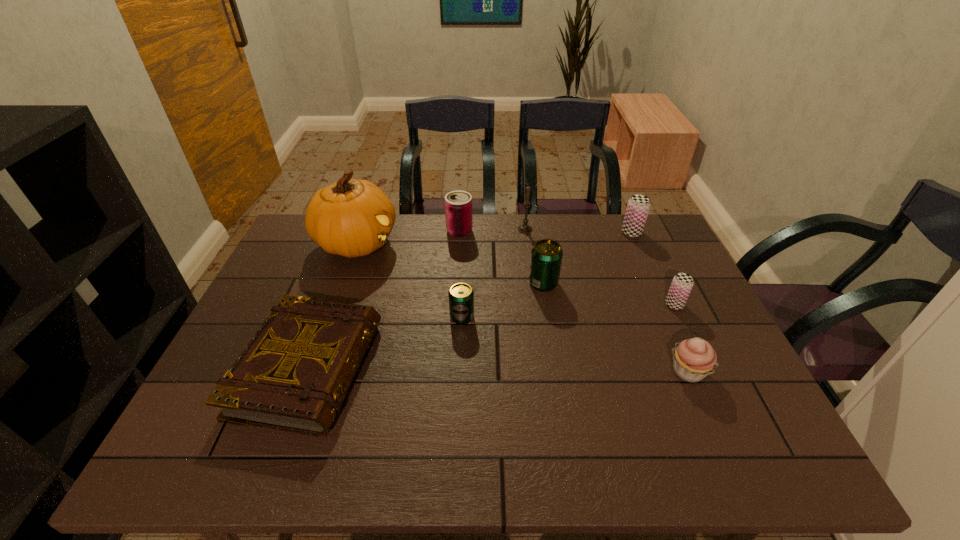
In order to click on cupcake that is at the right edge in this screenshot , I will do `click(693, 359)`.

Where is `object present at the far left corner`? object present at the far left corner is located at coordinates (352, 218).

What are the coordinates of `object that is positioned at the near left corner` in the screenshot? It's located at (294, 374).

You are a GUI agent. You are given a task and a screenshot of the screen. Output one action in this format:
    pyautogui.click(x=<x>, y=<y>)
    Task: Click on the object that is at the far right corner
    
    Given the screenshot: What is the action you would take?
    pyautogui.click(x=638, y=206)

This screenshot has width=960, height=540. What are the coordinates of `vacant space at the far edge` in the screenshot? It's located at (438, 237).

This screenshot has width=960, height=540. I want to click on vacant space at the near edge of the desktop, so click(x=362, y=466).

Identify the location of blank space at the right edge of the desktop. The image size is (960, 540). (722, 368).

Locate an element on the screen. Image resolution: width=960 pixels, height=540 pixels. free spot between the gray candle and the brown hardback book is located at coordinates (417, 299).

I want to click on blank region between the leftmost beer can and the second beer can from left to right, so click(x=503, y=300).

Where is `free spot between the pink can and the bigger green beer can`? free spot between the pink can and the bigger green beer can is located at coordinates (501, 257).